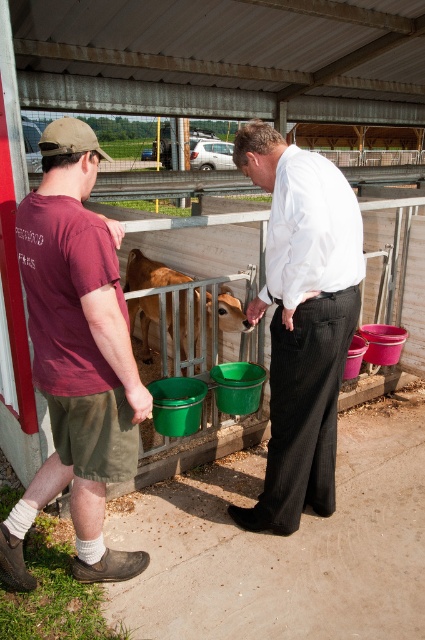
You are standing at the entrance of the farm enclosure and need to locate the white smooth shirt at center. According to the coordinates provided, where exactly is it positioned?

The white smooth shirt at center is located at point coordinates [302,321].